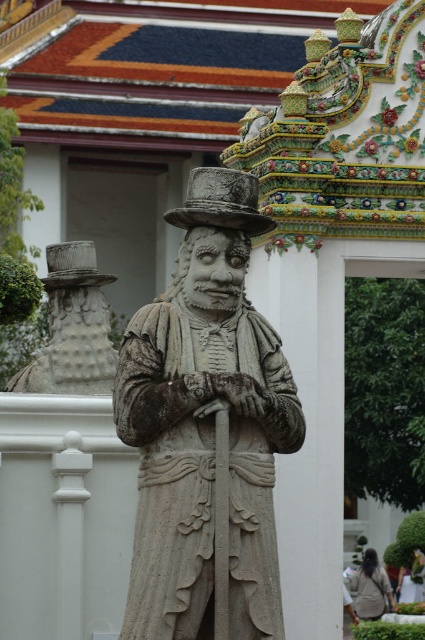
You are an art student analyzing the composition of the image. You notice the gray stone statue at left and the light brown fabric jacket at lower right. Which object is placed higher in the image?

The gray stone statue at left is positioned over light brown fabric jacket at lower right, so the gray stone statue at left is higher in the image.